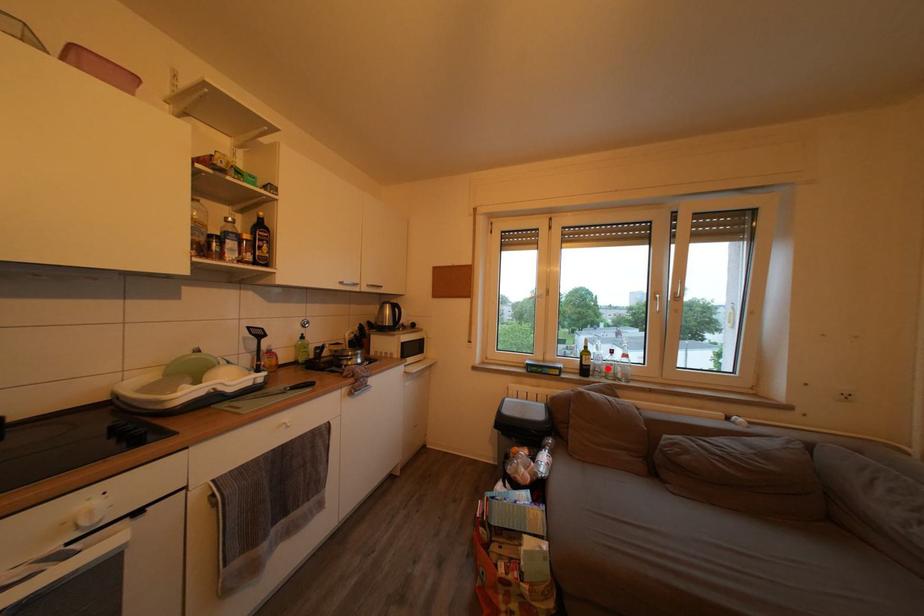
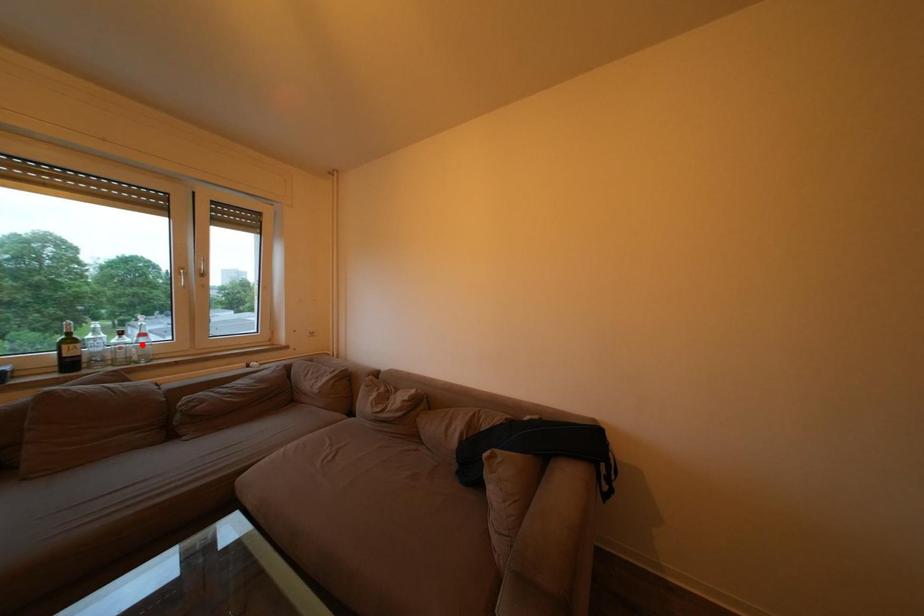
I am providing you with two images of the same scene from different viewpoints. A red point is marked on the first image and another point is marked on the second image. Do the highlighted points in image1 and image2 indicate the same real-world spot?

No